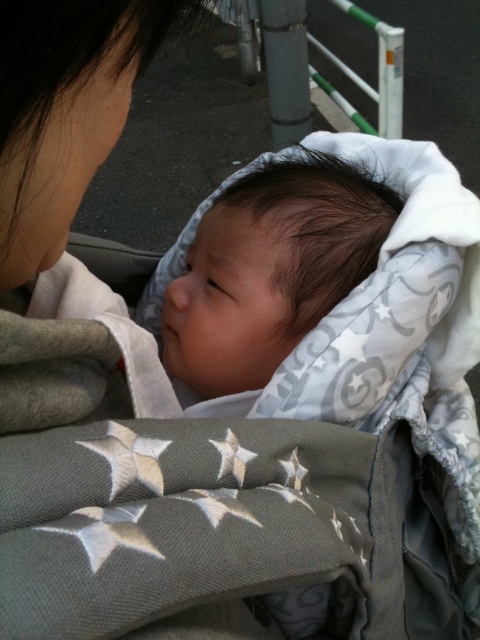
You are a photographer trying to capture the baby in the image. You need to ensure the soft gray blanket at center and the gray fabric at upper left are both visible in the frame. Which object should you prioritize framing wider to include both?

The soft gray blanket at center is wider than the gray fabric at upper left, so you should prioritize framing the soft gray blanket at center wider to accommodate its larger size while still including the gray fabric at upper left.

You are a photographer taking a picture of the baby in the scene. You notice two points in the image at coordinates point [295,300] and point [36,129]. Which point is closer to the camera?

Point [295,300] is further to the camera than point [36,129], so the point closer to the camera is point [36,129].

From the picture: You are a photographer trying to capture the baby in the image. You notice the soft gray blanket at center and the gray fabric at upper left. Which object is located to the right of the other?

The soft gray blanket at center is positioned on the right side of gray fabric at upper left.